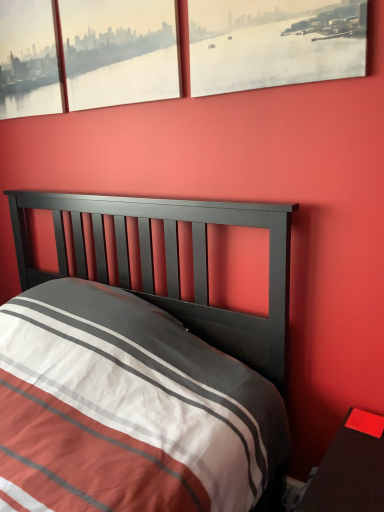
Question: From a real-world perspective, is matte paper cityscape at upper right, positioned as the 1th window in right-to-left order, positioned above or below smooth glossy wood nightstand at lower right?

Choices:
 (A) below
 (B) above

Answer: (B)

Question: Relative to smooth glossy wood nightstand at lower right, is matte paper cityscape at upper right, positioned as the 1th window in right-to-left order, in front or behind?

Choices:
 (A) behind
 (B) front

Answer: (A)

Question: Estimate the real-world distances between objects in this image. Which object is closer to the matte glass window at upper left, the 3th window viewed from the right?

Choices:
 (A) matte paper cityscape at upper right, the 3th window in the left-to-right sequence
 (B) matte glass window at upper left, arranged as the second window when viewed from the right
 (C) smooth glossy wood nightstand at lower right

Answer: (B)

Question: Which object is the farthest from the matte glass window at upper left, arranged as the 2th window when viewed from the left?

Choices:
 (A) matte glass window at upper left, the 3th window viewed from the right
 (B) smooth glossy wood nightstand at lower right
 (C) matte paper cityscape at upper right, positioned as the 1th window in right-to-left order

Answer: (B)